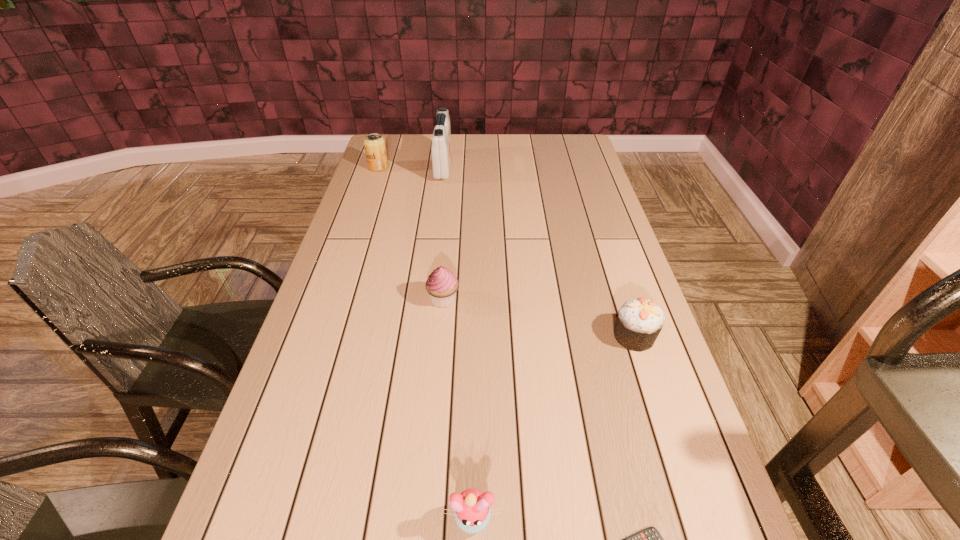
Where is `the tallest object`? The width and height of the screenshot is (960, 540). the tallest object is located at coordinates (441, 150).

Where is `the leftmost object`? The image size is (960, 540). the leftmost object is located at coordinates 374,144.

I want to click on the farthest cupcake, so click(442, 284).

Image resolution: width=960 pixels, height=540 pixels. Find the location of `the rightmost object`. the rightmost object is located at coordinates (639, 322).

Where is `the second nearest cupcake`? The image size is (960, 540). the second nearest cupcake is located at coordinates (639, 322).

Find the location of a particular element. The image size is (960, 540). the nearest cupcake is located at coordinates (472, 512).

At what (x,y) coordinates should I click in order to perform the action: click on vacant space located 0.400m on the front side of the first-aid kit. Please return your answer as a coordinate pair (x, y). The image size is (960, 540). Looking at the image, I should click on (555, 166).

Locate an element on the screen. free space located on the front of the beer can is located at coordinates (363, 213).

Image resolution: width=960 pixels, height=540 pixels. What are the coordinates of `free space located on the front of the farthest cupcake` in the screenshot? It's located at (441, 332).

Locate an element on the screen. free location located 0.170m on the back of the rightmost cupcake is located at coordinates [614, 275].